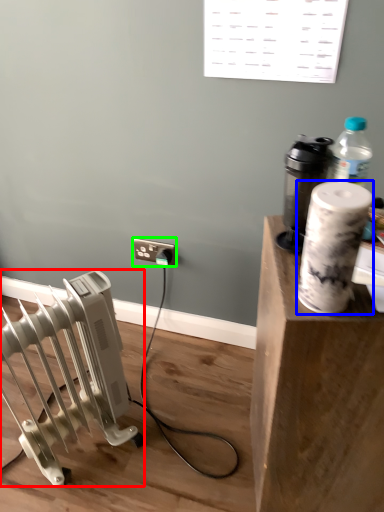
Question: Based on their relative distances, which object is nearer to radiator (highlighted by a red box)? Choose from paper towel (highlighted by a blue box) and electric outlet (highlighted by a green box).

Choices:
 (A) paper towel
 (B) electric outlet

Answer: (B)